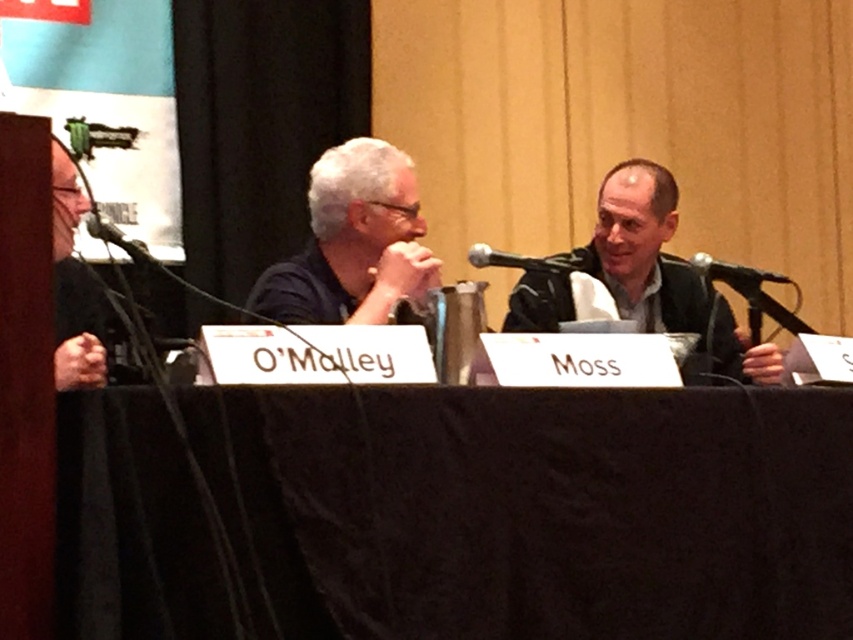
You are a sound technician preparing for a panel discussion. You have two microphones available, the black plastic microphone at center and the black matte microphone at left. Which one should you choose if you need a larger microphone for better visibility?

The black plastic microphone at center is bigger than the black matte microphone at left, so you should choose the black plastic microphone at center for better visibility.

You are organizing a panel discussion and need to ensure that all microphones fit on a narrow table. Based on the image, which microphone between the black plastic microphone at center and the black matte microphone at left is wider and might not fit?

The black plastic microphone at center might be wider than the black matte microphone at left, so it might not fit on the narrow table.